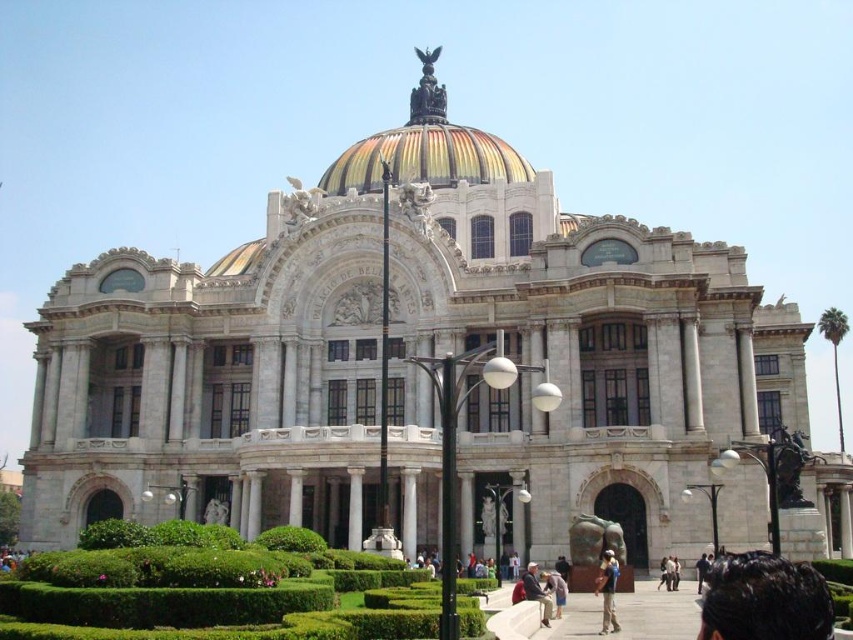
You are a tour guide leading a group to the entrance of the Palacio de Bellas Artes. You notice a tourist wearing a light brown leather jacket at center and dark blue jeans at center. The tourist is currently 15 meters away from the entrance. If the entrance requires maintaining a 1.5 meter distance between visitors, can the tourist safely approach the entrance without violating the distance rule?

The distance between the light brown leather jacket at center and dark blue jeans at center is 13.75 meters, which is greater than the required 1.5 meters. Therefore, the tourist can safely approach the entrance without violating the distance rule.

You are standing in front of the Palacio de Bellas Artes and want to take a photo of the polished bronze eagle at center and the dark blue jeans at center. Which object should you focus on first to ensure both are in the frame?

The polished bronze eagle at center is further to the viewer than the dark blue jeans at center, so you should focus on the polished bronze eagle at center first to ensure both are in the frame.

You are an artist planning to sketch the Palacio de Bellas Artes. You notice two elements in the scene that you want to include in your drawing. One is the dark brown hair at lower right and the other is the light brown leather jacket at center. Which of these two elements should you draw first if you want to follow the size relationship between them?

The dark brown hair at lower right is bigger than the light brown leather jacket at center, so you should draw the dark brown hair at lower right first to maintain the correct size relationship between the two elements.